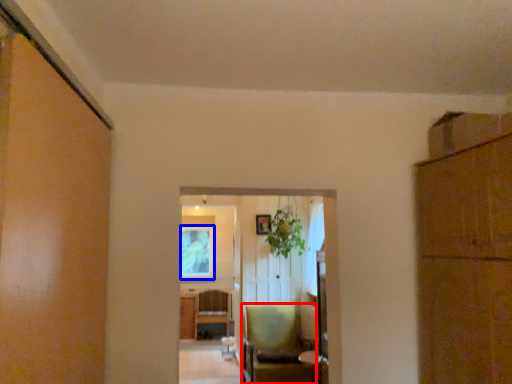
Question: Which of the following is the farthest to the observer, chair (highlighted by a red box) or window screen (highlighted by a blue box)?

Choices:
 (A) chair
 (B) window screen

Answer: (B)